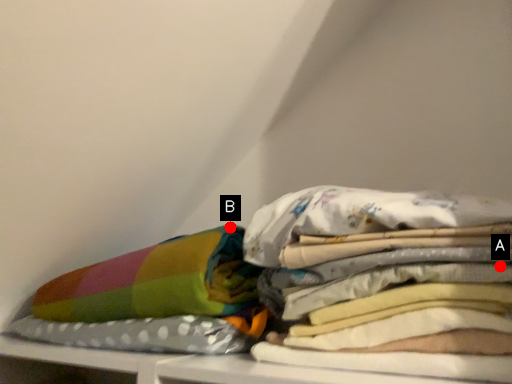
Question: Two points are circled on the image, labeled by A and B beside each circle. Which point appears farthest from the camera in this image?

Choices:
 (A) A is further
 (B) B is further

Answer: (B)